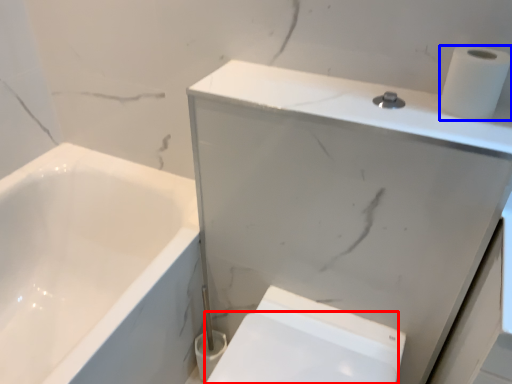
Question: Which of the following is the closest to the observer, bidet (highlighted by a red box) or toilet paper (highlighted by a blue box)?

Choices:
 (A) bidet
 (B) toilet paper

Answer: (B)